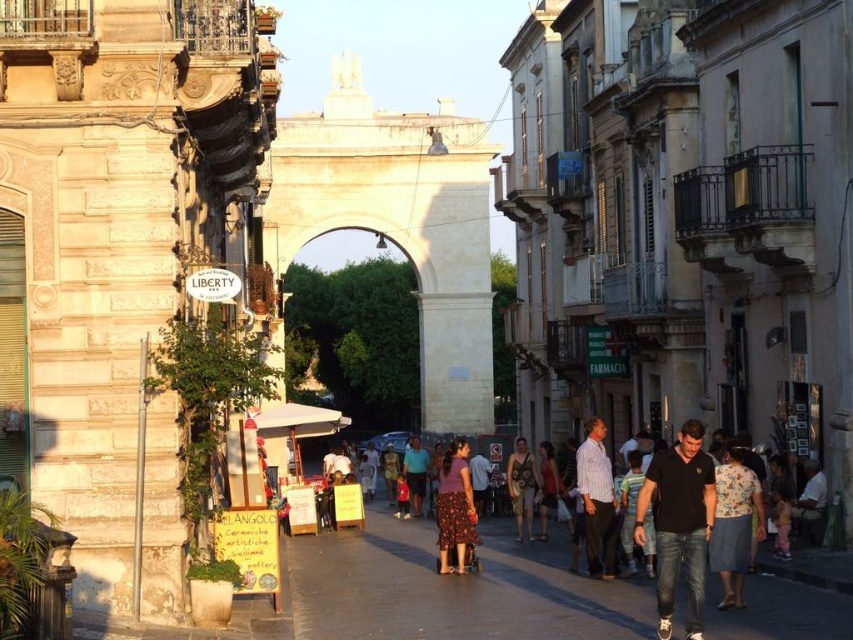
You are a delivery person who needs to place a package on the smooth concrete sidewalk at center. Can you confirm the exact coordinates where you should place the package?

The smooth concrete sidewalk at center should be placed at coordinates point (453, 588).